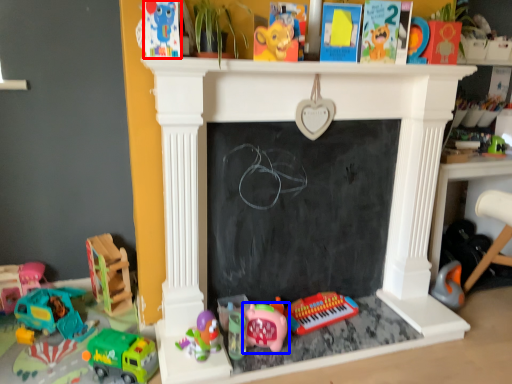
Question: Which point is closer to the camera, toy (highlighted by a red box) or toy (highlighted by a blue box)?

Choices:
 (A) toy
 (B) toy

Answer: (A)